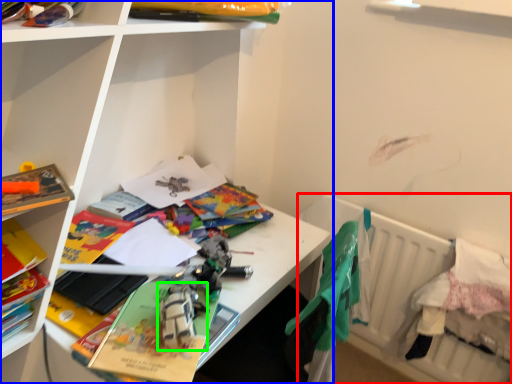
Question: Considering the real-world distances, which object is closest to bed (highlighted by a red box)? shelf (highlighted by a blue box) or toy (highlighted by a green box).

Choices:
 (A) shelf
 (B) toy

Answer: (A)